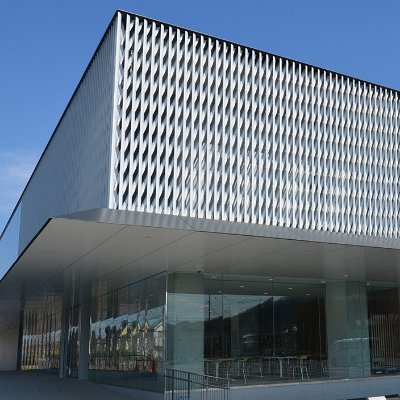
Identify the location of ceiling. (72, 255), (235, 243).